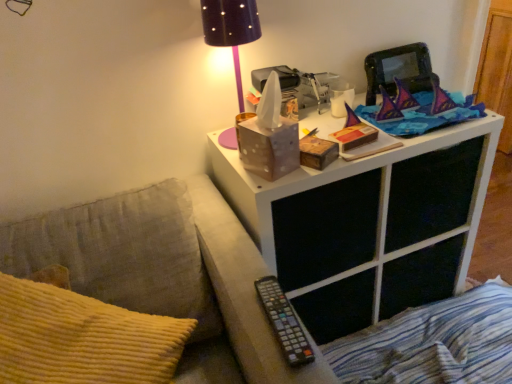
Question: Is white matte nightstand at upper right to the left or to the right of blue striped fabric at lower right in the image?

Choices:
 (A) right
 (B) left

Answer: (B)

Question: From the image's perspective, relative to blue striped fabric at lower right, is white matte nightstand at upper right above or below?

Choices:
 (A) above
 (B) below

Answer: (A)

Question: Which object is the farthest from the yellow corduroy pillow at lower left?

Choices:
 (A) white matte nightstand at upper right
 (B) blue striped fabric at lower right
 (C) white matte side table at upper right
 (D) black dotted fabric lampshade at upper center
 (E) black plastic remote at lower center

Answer: (B)

Question: Considering the real-world distances, which object is farthest from the black dotted fabric lampshade at upper center?

Choices:
 (A) black plastic remote at lower center
 (B) white matte side table at upper right
 (C) blue striped fabric at lower right
 (D) yellow corduroy pillow at lower left
 (E) white matte nightstand at upper right

Answer: (C)